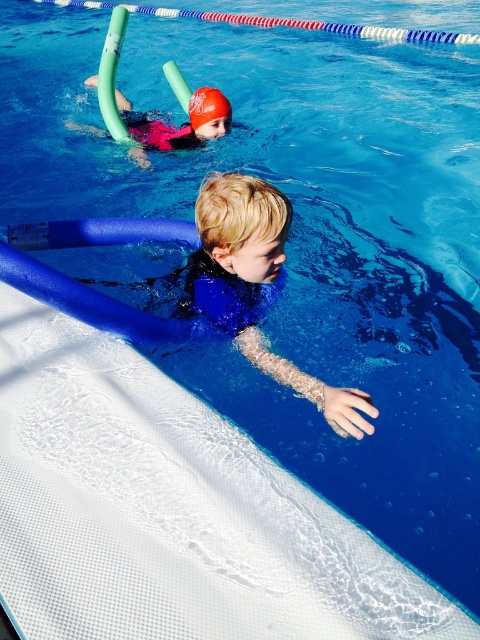
Between blue rubber vest at lower center and pink matte life jacket at upper center, which one has less height?

pink matte life jacket at upper center is shorter.

Is blue rubber vest at lower center bigger than pink matte life jacket at upper center?

Indeed, blue rubber vest at lower center has a larger size compared to pink matte life jacket at upper center.

Describe the element at coordinates (255, 285) in the screenshot. The image size is (480, 640). I see `blue rubber vest at lower center` at that location.

This screenshot has height=640, width=480. What are the coordinates of `blue rubber vest at lower center` in the screenshot? It's located at (255, 285).

Can you confirm if matte pink swim cap at upper center is taller than pink matte life jacket at upper center?

Indeed, matte pink swim cap at upper center has a greater height compared to pink matte life jacket at upper center.

Is point (204, 109) positioned behind point (184, 125)?

No, it is not.

In order to click on matte pink swim cap at upper center in this screenshot , I will do `click(180, 125)`.

Who is shorter, blue rubber vest at lower center or matte pink swim cap at upper center?

Standing shorter between the two is blue rubber vest at lower center.

Is blue rubber vest at lower center to the left of matte pink swim cap at upper center from the viewer's perspective?

In fact, blue rubber vest at lower center is to the right of matte pink swim cap at upper center.

In the scene shown: Who is more forward, (243, 305) or (192, 145)?

Point (243, 305)

The height and width of the screenshot is (640, 480). In order to click on blue rubber vest at lower center in this screenshot , I will do `click(255, 285)`.